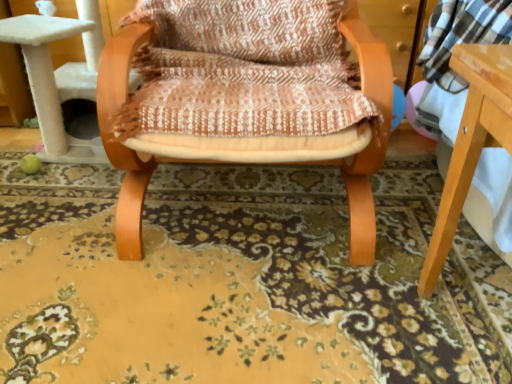
The image size is (512, 384). Find the location of `floral carpet at center`. floral carpet at center is located at coordinates (240, 281).

What do you see at coordinates (240, 281) in the screenshot? The width and height of the screenshot is (512, 384). I see `floral carpet at center` at bounding box center [240, 281].

Measure the distance between point (x=173, y=17) and camera.

Point (x=173, y=17) and camera are 4.06 feet apart.

What do you see at coordinates (245, 100) in the screenshot?
I see `wooden chair at center` at bounding box center [245, 100].

At what (x,y) coordinates should I click in order to perform the action: click on wooden chair at center. Please return your answer as a coordinate pair (x, y). This screenshot has height=384, width=512. Looking at the image, I should click on (245, 100).

At what (x,y) coordinates should I click in order to perform the action: click on floral carpet at center. Please return your answer as a coordinate pair (x, y). Looking at the image, I should click on (240, 281).

Between wooden chair at center and floral carpet at center, which one appears on the left side from the viewer's perspective?

floral carpet at center is more to the left.

Which object is more forward, wooden chair at center or floral carpet at center?

Positioned in front is wooden chair at center.

Which is behind, point (117, 69) or point (315, 282)?

The point (315, 282) is more distant.

From the image's perspective, which object appears higher, wooden chair at center or floral carpet at center?

wooden chair at center.

From a real-world perspective, is wooden chair at center physically located above or below floral carpet at center?

From a real-world perspective, wooden chair at center is physically above floral carpet at center.

Considering the relative sizes of wooden chair at center and floral carpet at center in the image provided, is wooden chair at center thinner than floral carpet at center?

Indeed, wooden chair at center has a lesser width compared to floral carpet at center.

Can you confirm if wooden chair at center is shorter than floral carpet at center?

No, wooden chair at center is not shorter than floral carpet at center.

Between wooden chair at center and floral carpet at center, which one has larger size?

wooden chair at center.

Can we say wooden chair at center lies outside floral carpet at center?

Absolutely, wooden chair at center is external to floral carpet at center.

Is wooden chair at center not close to floral carpet at center?

No.

Is wooden chair at center positioned with its back to floral carpet at center?

No.

How different are the orientations of wooden chair at center and floral carpet at center in degrees?

The angle between the facing direction of wooden chair at center and the facing direction of floral carpet at center is 89.3 degrees.

Find the location of a particular element. The height and width of the screenshot is (384, 512). chair above the floral carpet at center (from the image's perspective) is located at coordinates (245, 100).

Does floral carpet at center appear on the left side of wooden chair at center?

Correct, you'll find floral carpet at center to the left of wooden chair at center.

Considering their positions, is floral carpet at center located in front of or behind wooden chair at center?

In the image, floral carpet at center appears behind wooden chair at center.

Is point (267, 370) more distant than point (247, 58)?

No, it is in front of (247, 58).

From the image's perspective, would you say floral carpet at center is positioned over wooden chair at center?

Incorrect, from the image's perspective, floral carpet at center is lower than wooden chair at center.

From the picture: From a real-world perspective, is floral carpet at center physically located above or below wooden chair at center?

Clearly, from a real-world perspective, floral carpet at center is below wooden chair at center.

Is floral carpet at center wider or thinner than wooden chair at center?

floral carpet at center is wider than wooden chair at center.

Is floral carpet at center taller than wooden chair at center?

Incorrect, the height of floral carpet at center is not larger of that of wooden chair at center.

Considering the sizes of objects floral carpet at center and wooden chair at center in the image provided, who is smaller, floral carpet at center or wooden chair at center?

floral carpet at center is smaller.

Is wooden chair at center a part of floral carpet at center?

No, wooden chair at center is located outside of floral carpet at center.

Is floral carpet at center far from wooden chair at center?

No, floral carpet at center is in close proximity to wooden chair at center.

Is wooden chair at center at the back of floral carpet at center?

No, floral carpet at center's orientation is not away from wooden chair at center.

Where is `mat on the left of wooden chair at center`? Image resolution: width=512 pixels, height=384 pixels. mat on the left of wooden chair at center is located at coordinates (240, 281).

Locate an element on the screen. chair in front of the floral carpet at center is located at coordinates (245, 100).

Image resolution: width=512 pixels, height=384 pixels. In the image, there is a wooden chair at center. What are the coordinates of `mat below it (from the image's perspective)` in the screenshot? It's located at (240, 281).